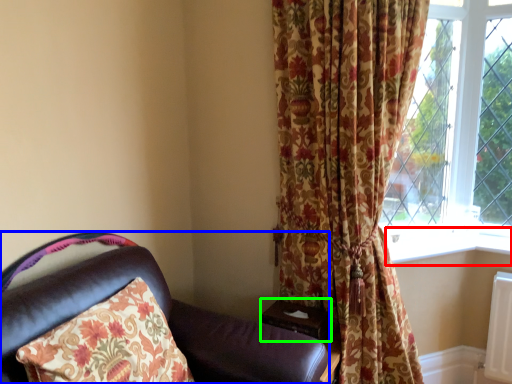
Question: Which object is positioned closest to window sill (highlighted by a red box)? Select from chair (highlighted by a blue box) and table (highlighted by a green box).

Choices:
 (A) chair
 (B) table

Answer: (B)